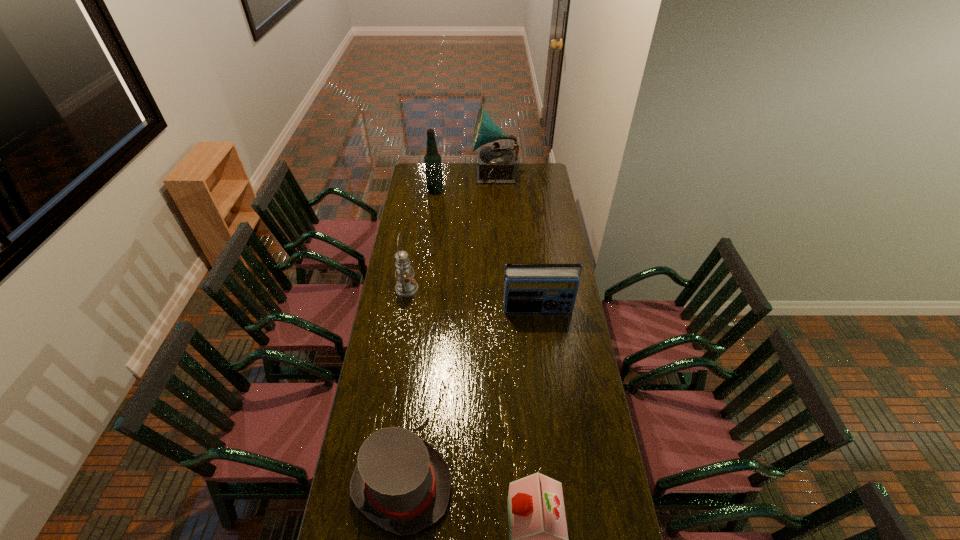
Locate which object ranks second in proximity to the third tallest object. Please provide its 2D coordinates. Your answer should be formatted as a tuple, i.e. [(x, y)], where the tuple contains the x and y coordinates of a point satisfying the conditions above.

[(401, 483)]

The width and height of the screenshot is (960, 540). I want to click on free point that satisfies the following two spatial constraints: 1. on the horn of the record player; 2. on the front side of the fourth nearest object, so click(x=499, y=288).

This screenshot has height=540, width=960. In order to click on vacant space that satisfies the following two spatial constraints: 1. on the horn of the record player; 2. on the front side of the alcohol in this screenshot , I will do `click(495, 191)`.

The image size is (960, 540). What are the coordinates of `vacant space that satisfies the following two spatial constraints: 1. on the back side of the alcohol; 2. on the left side of the fourth nearest object` in the screenshot? It's located at (422, 191).